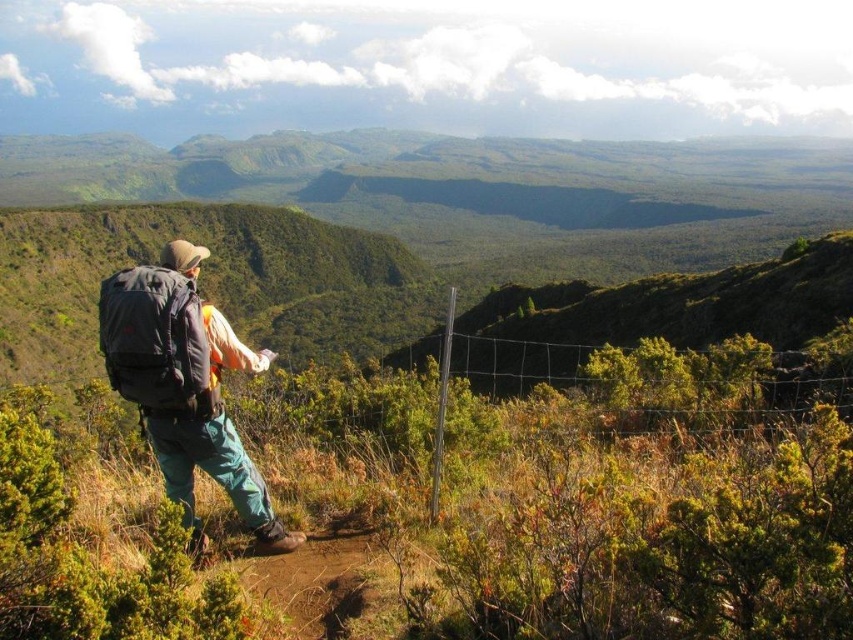
Question: Does matte black backpack at center-left come in front of wire mesh fence at center?

Choices:
 (A) yes
 (B) no

Answer: (A)

Question: Does matte black backpack at center-left have a smaller size compared to wire mesh fence at center?

Choices:
 (A) yes
 (B) no

Answer: (A)

Question: Is matte black backpack at center-left in front of wire mesh fence at center?

Choices:
 (A) no
 (B) yes

Answer: (B)